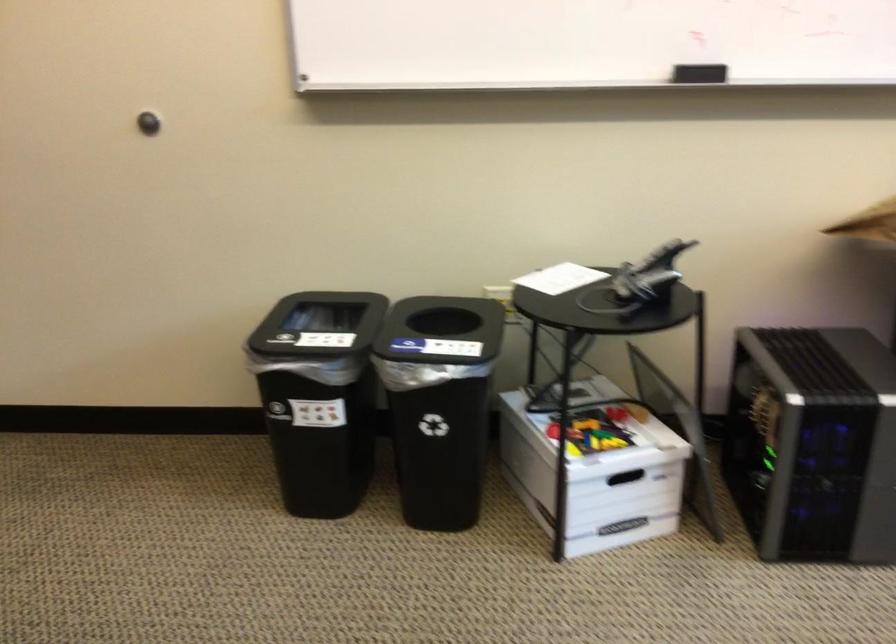
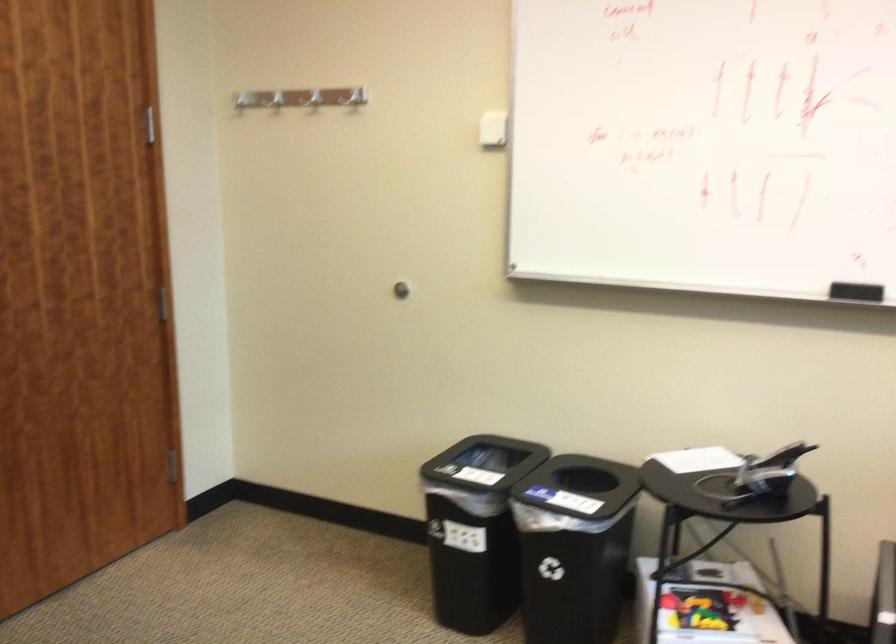
Question: How did the camera likely rotate?

Choices:
 (A) Left
 (B) Right
 (C) Up
 (D) Down

Answer: (A)